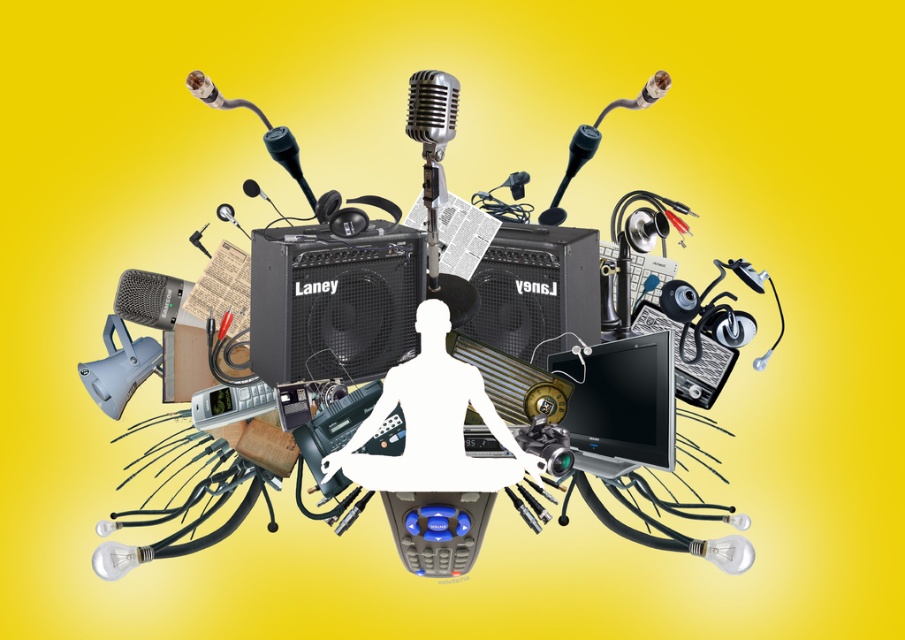
Based on the photo, which of these two, black glossy monitor at center or shiny silver microphone at center, stands taller?

shiny silver microphone at center

Is the position of black glossy monitor at center more distant than that of shiny silver microphone at center?

Yes, it is.

At what (x,y) coordinates should I click in order to perform the action: click on black glossy monitor at center. Please return your answer as a coordinate pair (x, y). Looking at the image, I should click on (621, 404).

Can you confirm if black glossy monitor at center is positioned above metallic black microphone at center?

Incorrect, black glossy monitor at center is not positioned above metallic black microphone at center.

Describe the element at coordinates (621, 404) in the screenshot. I see `black glossy monitor at center` at that location.

The image size is (905, 640). In order to click on black glossy monitor at center in this screenshot , I will do `click(621, 404)`.

Is metallic silver microphone at upper center bigger than black matte microphone at center?

Correct, metallic silver microphone at upper center is larger in size than black matte microphone at center.

Between metallic silver microphone at upper center and black matte microphone at center, which one appears on the right side from the viewer's perspective?

metallic silver microphone at upper center is more to the right.

Is point (556, 221) less distant than point (554, 224)?

Yes, it is in front of point (554, 224).

The width and height of the screenshot is (905, 640). I want to click on metallic silver microphone at upper center, so (599, 140).